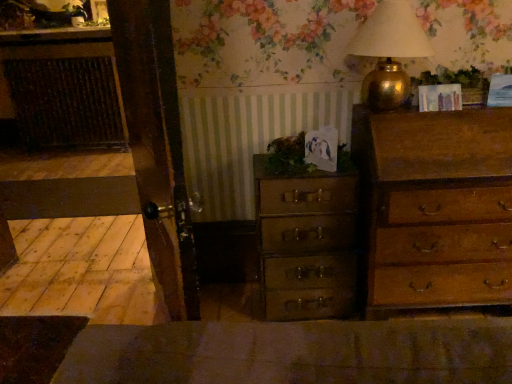
What do you see at coordinates (288, 157) in the screenshot?
I see `green leafy plant at center, the first plant positioned from the left` at bounding box center [288, 157].

What is the approximate width of wooden chest of drawers at center, which is the first chest of drawers in left-to-right order?

13.53 inches.

Identify the location of wooden chest of drawers at right, the second chest of drawers positioned from the left. (435, 207).

The width and height of the screenshot is (512, 384). What are the coordinates of `gold metallic table lamp at upper right` in the screenshot? It's located at (389, 52).

Are green leafy plant at upper right, acting as the 1th plant starting from the right, and rustic wicker cabinet at left making contact?

No, green leafy plant at upper right, acting as the 1th plant starting from the right, is not touching rustic wicker cabinet at left.

Would you say green leafy plant at upper right, acting as the 1th plant starting from the right, is inside or outside rustic wicker cabinet at left?

green leafy plant at upper right, acting as the 1th plant starting from the right, is outside rustic wicker cabinet at left.

From the image's perspective, which one is positioned lower, green leafy plant at upper right, acting as the 2th plant starting from the left, or rustic wicker cabinet at left?

green leafy plant at upper right, acting as the 2th plant starting from the left, is shown below in the image.

At what (x,y) coordinates should I click in order to perform the action: click on the 2nd plant above the rustic wicker cabinet at left (from a real-world perspective). Please return your answer as a coordinate pair (x, y). Looking at the image, I should click on (455, 83).

Is point (60, 139) positioned in front of point (335, 189)?

No.

Can you tell me how much rustic wicker cabinet at left and wooden chest of drawers at center, which is counted as the second chest of drawers, starting from the right, differ in facing direction?

They differ by 4.8 degrees in their facing directions.

Which object is wider, rustic wicker cabinet at left or wooden chest of drawers at center, which is the first chest of drawers in left-to-right order?

Wider between the two is wooden chest of drawers at center, which is the first chest of drawers in left-to-right order.

Is wooden chest of drawers at center, which is the first chest of drawers in left-to-right order, at the back of green leafy plant at upper right, which is the 1th plant from top to bottom?

That's not correct — green leafy plant at upper right, which is the 1th plant from top to bottom, is not looking away from wooden chest of drawers at center, which is the first chest of drawers in left-to-right order.

What are the coordinates of `the 1st chest of drawers in front of the green leafy plant at upper right, which is the 1th plant from top to bottom, starting your count from the anchor` in the screenshot? It's located at (306, 244).

Is green leafy plant at upper right, acting as the second plant starting from the bottom, far from wooden chest of drawers at center, which is the first chest of drawers in left-to-right order?

That's not correct — green leafy plant at upper right, acting as the second plant starting from the bottom, is a little close to wooden chest of drawers at center, which is the first chest of drawers in left-to-right order.

Between green leafy plant at upper right, acting as the 1th plant starting from the right, and wooden chest of drawers at center, which is the first chest of drawers in left-to-right order, which one has larger width?

wooden chest of drawers at center, which is the first chest of drawers in left-to-right order, is wider.

Can you confirm if wooden chest of drawers at center, which is the first chest of drawers in left-to-right order, is positioned to the left of rustic wicker cabinet at left?

In fact, wooden chest of drawers at center, which is the first chest of drawers in left-to-right order, is to the right of rustic wicker cabinet at left.

Considering the sizes of objects wooden chest of drawers at center, which is counted as the second chest of drawers, starting from the right, and rustic wicker cabinet at left in the image provided, who is thinner, wooden chest of drawers at center, which is counted as the second chest of drawers, starting from the right, or rustic wicker cabinet at left?

rustic wicker cabinet at left is thinner.

Considering the sizes of objects wooden chest of drawers at center, which is counted as the second chest of drawers, starting from the right, and rustic wicker cabinet at left in the image provided, who is smaller, wooden chest of drawers at center, which is counted as the second chest of drawers, starting from the right, or rustic wicker cabinet at left?

With smaller size is wooden chest of drawers at center, which is counted as the second chest of drawers, starting from the right.

Is wooden chest of drawers at center, which is counted as the second chest of drawers, starting from the right, beside rustic wicker cabinet at left?

They are not placed beside each other.

From a real-world perspective, who is located higher, green leafy plant at center, which is counted as the 2th plant, starting from the right, or gold metallic table lamp at upper right?

gold metallic table lamp at upper right.

From the image's perspective, which is below, green leafy plant at center, the first plant from the bottom, or gold metallic table lamp at upper right?

green leafy plant at center, the first plant from the bottom.

Is point (290, 150) positioned behind point (400, 11)?

Yes, it is.

From the image's perspective, is rustic wicker cabinet at left below green leafy plant at upper right, acting as the 2th plant starting from the left?

Incorrect, from the image's perspective, rustic wicker cabinet at left is higher than green leafy plant at upper right, acting as the 2th plant starting from the left.

Is rustic wicker cabinet at left behind green leafy plant at upper right, acting as the 1th plant starting from the right?

Yes, rustic wicker cabinet at left is further from the camera.

Image resolution: width=512 pixels, height=384 pixels. Identify the location of cabinetry behind the green leafy plant at upper right, acting as the 2th plant starting from the left. (64, 87).

Could you measure the distance between rustic wicker cabinet at left and green leafy plant at upper right, acting as the 1th plant starting from the right?

rustic wicker cabinet at left is 11.67 feet from green leafy plant at upper right, acting as the 1th plant starting from the right.

Which is more to the left, gold metallic table lamp at upper right or wooden chest of drawers at center, which is the first chest of drawers in left-to-right order?

Positioned to the left is wooden chest of drawers at center, which is the first chest of drawers in left-to-right order.

Is gold metallic table lamp at upper right bigger or smaller than wooden chest of drawers at center, which is the first chest of drawers in left-to-right order?

gold metallic table lamp at upper right is smaller than wooden chest of drawers at center, which is the first chest of drawers in left-to-right order.

Does gold metallic table lamp at upper right come in front of wooden chest of drawers at center, which is the first chest of drawers in left-to-right order?

Yes, it is in front of wooden chest of drawers at center, which is the first chest of drawers in left-to-right order.

Where is `cabinetry that appears behind the green leafy plant at upper right, acting as the 2th plant starting from the left`? This screenshot has height=384, width=512. cabinetry that appears behind the green leafy plant at upper right, acting as the 2th plant starting from the left is located at coordinates (64, 87).

Where is `the 2nd chest of drawers below the rustic wicker cabinet at left (from the image's perspective)`? the 2nd chest of drawers below the rustic wicker cabinet at left (from the image's perspective) is located at coordinates (306, 244).

Estimate the real-world distances between objects in this image. Which object is further from green leafy plant at upper right, acting as the 1th plant starting from the right, wooden chest of drawers at right, the second chest of drawers positioned from the left, or green leafy plant at center, the first plant positioned from the left?

green leafy plant at center, the first plant positioned from the left.

Estimate the real-world distances between objects in this image. Which object is closer to green leafy plant at center, which is counted as the 2th plant, starting from the right, green leafy plant at upper right, which is the 1th plant from top to bottom, or rustic wicker cabinet at left?

green leafy plant at upper right, which is the 1th plant from top to bottom.

Which object lies further to the anchor point rustic wicker cabinet at left, green leafy plant at upper right, acting as the 2th plant starting from the left, or wooden chest of drawers at right, the second chest of drawers positioned from the left?

green leafy plant at upper right, acting as the 2th plant starting from the left, is positioned further to the anchor rustic wicker cabinet at left.

Which object lies further to the anchor point rustic wicker cabinet at left, green leafy plant at upper right, which is the 1th plant from top to bottom, or wooden chest of drawers at center, which is counted as the second chest of drawers, starting from the right?

green leafy plant at upper right, which is the 1th plant from top to bottom, lies further to rustic wicker cabinet at left than the other object.

Based on their spatial positions, is wooden chest of drawers at right, positioned as the 1th chest of drawers in right-to-left order, or green leafy plant at center, the first plant positioned from the left, further from wooden chest of drawers at center, which is counted as the second chest of drawers, starting from the right?

wooden chest of drawers at right, positioned as the 1th chest of drawers in right-to-left order.

From the image, which object appears to be nearer to wooden chest of drawers at center, which is counted as the second chest of drawers, starting from the right, green leafy plant at upper right, acting as the 2th plant starting from the left, or green leafy plant at center, the first plant positioned from the left?

green leafy plant at center, the first plant positioned from the left, lies closer to wooden chest of drawers at center, which is counted as the second chest of drawers, starting from the right, than the other object.

Looking at the image, which one is located further to green leafy plant at upper right, which is the 1th plant from top to bottom, wooden chest of drawers at center, which is counted as the second chest of drawers, starting from the right, or green leafy plant at center, the first plant from the bottom?

The object further to green leafy plant at upper right, which is the 1th plant from top to bottom, is wooden chest of drawers at center, which is counted as the second chest of drawers, starting from the right.

When comparing their distances from green leafy plant at center, which is counted as the 2th plant, starting from the right, does wooden chest of drawers at center, which is counted as the second chest of drawers, starting from the right, or rustic wicker cabinet at left seem closer?

The object closer to green leafy plant at center, which is counted as the 2th plant, starting from the right, is wooden chest of drawers at center, which is counted as the second chest of drawers, starting from the right.

You are a GUI agent. You are given a task and a screenshot of the screen. Output one action in this format:
    pyautogui.click(x=<x>, y=<y>)
    Task: Click on the table lamp located between green leafy plant at center, which is the second plant from top to bottom, and wooden chest of drawers at right, positioned as the 1th chest of drawers in right-to-left order, in the left-right direction
    
    Given the screenshot: What is the action you would take?
    pyautogui.click(x=389, y=52)

I want to click on chest of drawers between wooden chest of drawers at center, which is the first chest of drawers in left-to-right order, and green leafy plant at upper right, acting as the 1th plant starting from the right, from left to right, so click(x=435, y=207).

Image resolution: width=512 pixels, height=384 pixels. I want to click on plant between rustic wicker cabinet at left and green leafy plant at upper right, acting as the second plant starting from the bottom, so click(x=288, y=157).

Identify the location of table lamp situated between green leafy plant at center, which is the second plant from top to bottom, and green leafy plant at upper right, acting as the second plant starting from the bottom, from left to right. This screenshot has height=384, width=512. (389, 52).